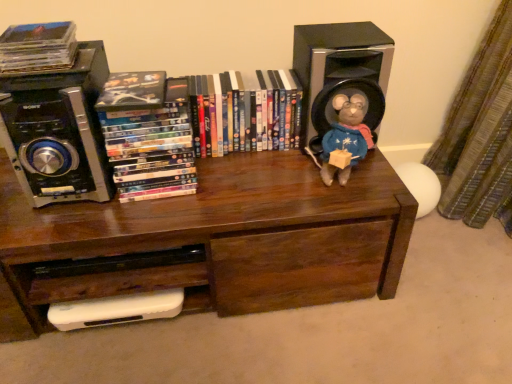
Question: In terms of height, does matte plastic dvds at left, positioned as the second book in left-to-right order, look taller or shorter compared to black plastic speaker at upper right, arranged as the second speaker when viewed from the left?

Choices:
 (A) short
 (B) tall

Answer: (A)

Question: From the image's perspective, is matte plastic dvds at left, positioned as the 2th book in right-to-left order, located above or below black plastic speaker at upper right, arranged as the second speaker when viewed from the left?

Choices:
 (A) below
 (B) above

Answer: (A)

Question: Based on their relative distances, which object is farther from the fuzzy fabric stuffed animal at upper right?

Choices:
 (A) brown wood bookcase at center
 (B) matte plastic dvds at center, marked as the first book in a right-to-left arrangement
 (C) white plastic drawer at lower left
 (D) matte black compact disc at upper left, the 3th book positioned from the right
 (E) black plastic speaker at upper left, arranged as the first speaker when viewed from the left

Answer: (D)

Question: Which object is the farthest from the matte plastic dvds at left, positioned as the second book in left-to-right order?

Choices:
 (A) black plastic speaker at upper right, arranged as the second speaker when viewed from the left
 (B) brown wood bookcase at center
 (C) matte plastic dvds at center, marked as the first book in a right-to-left arrangement
 (D) matte black compact disc at upper left, the 1th book when ordered from left to right
 (E) white plastic drawer at lower left

Answer: (A)